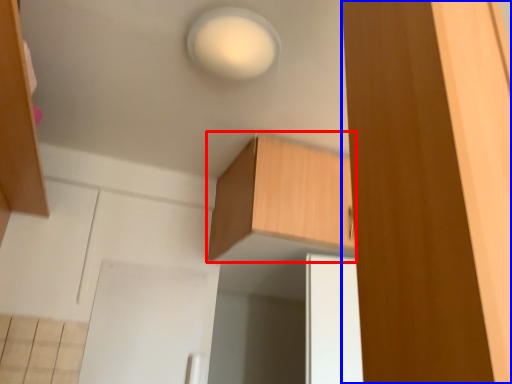
Question: Which point is further to the camera, cabinetry (highlighted by a red box) or cabinetry (highlighted by a blue box)?

Choices:
 (A) cabinetry
 (B) cabinetry

Answer: (A)